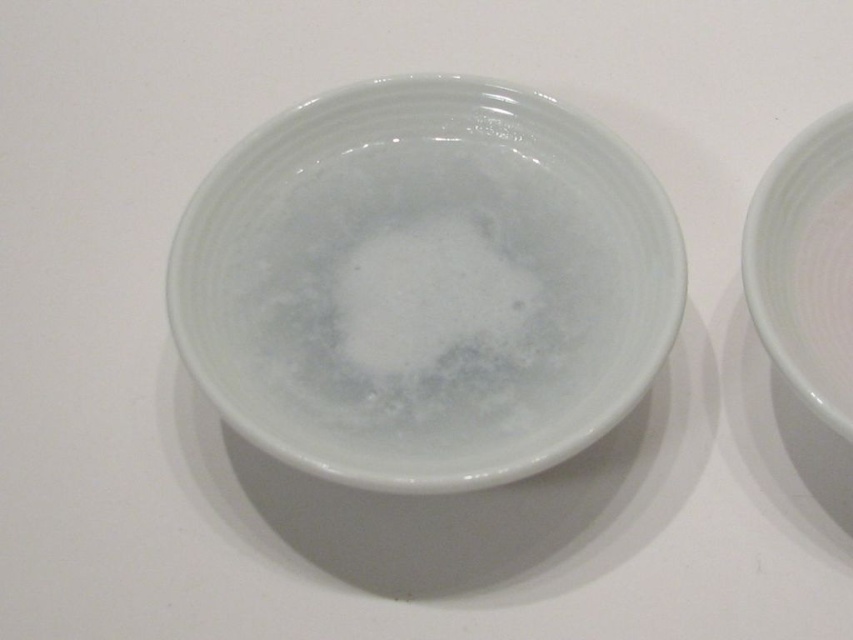
In the scene shown: Who is higher up, glossy ceramic bowl at center or white glossy bowl at right?

Positioned higher is white glossy bowl at right.

Can you confirm if glossy ceramic bowl at center is shorter than white glossy bowl at right?

No, glossy ceramic bowl at center is not shorter than white glossy bowl at right.

What do you see at coordinates (407, 218) in the screenshot? I see `glossy ceramic bowl at center` at bounding box center [407, 218].

Locate an element on the screen. The width and height of the screenshot is (853, 640). glossy ceramic bowl at center is located at coordinates (407, 218).

Consider the image. Does glossy ceramic bowl at center have a greater width compared to white frothy foam at center?

Indeed, glossy ceramic bowl at center has a greater width compared to white frothy foam at center.

You are a GUI agent. You are given a task and a screenshot of the screen. Output one action in this format:
    pyautogui.click(x=<x>, y=<y>)
    Task: Click on the glossy ceramic bowl at center
    This screenshot has width=853, height=640.
    Given the screenshot: What is the action you would take?
    pyautogui.click(x=407, y=218)

Does white frothy foam at center have a greater height compared to white glossy bowl at right?

No.

Can you confirm if white frothy foam at center is wider than white glossy bowl at right?

Yes.

Image resolution: width=853 pixels, height=640 pixels. Identify the location of white frothy foam at center. (431, 298).